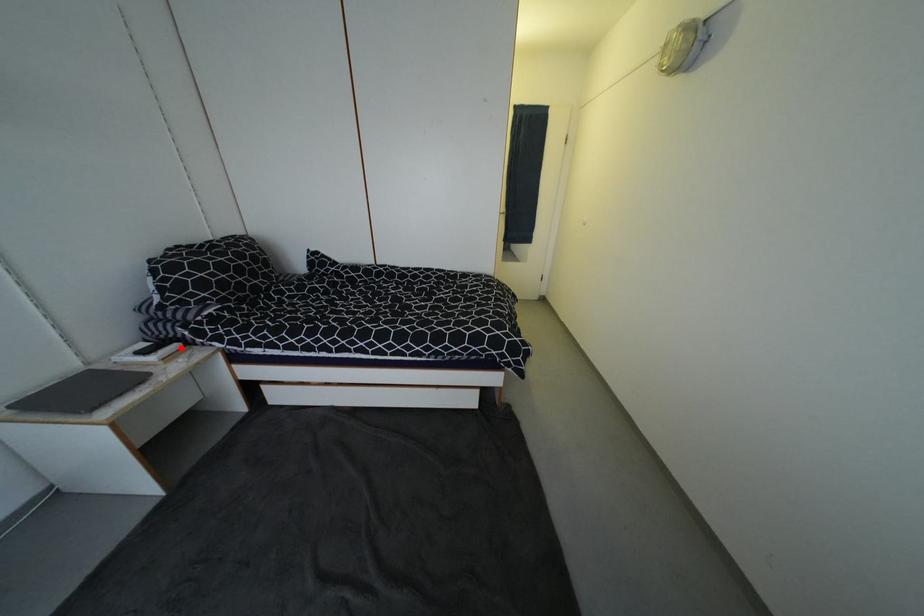
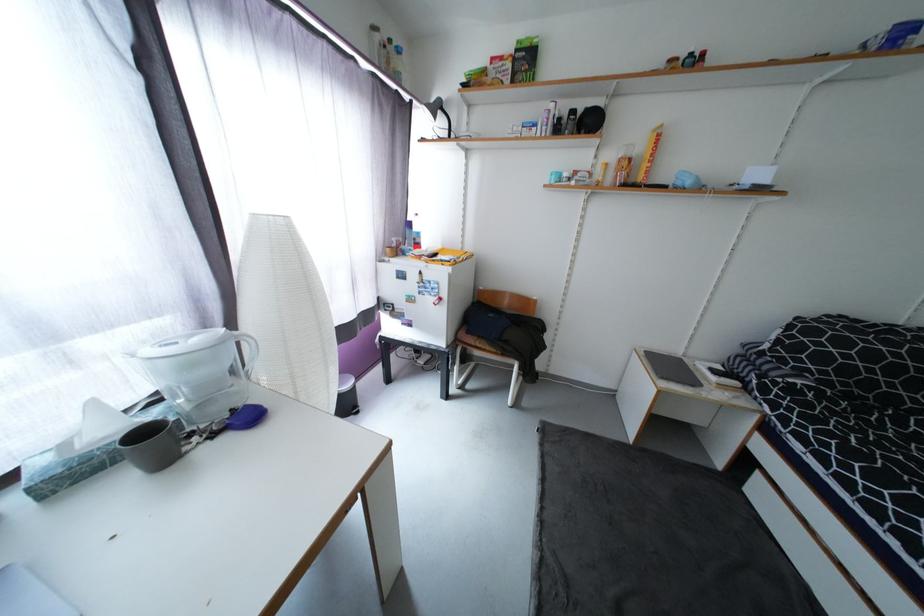
Where in the second image is the point corresponding to the highlighted location from the first image?

(740, 385)